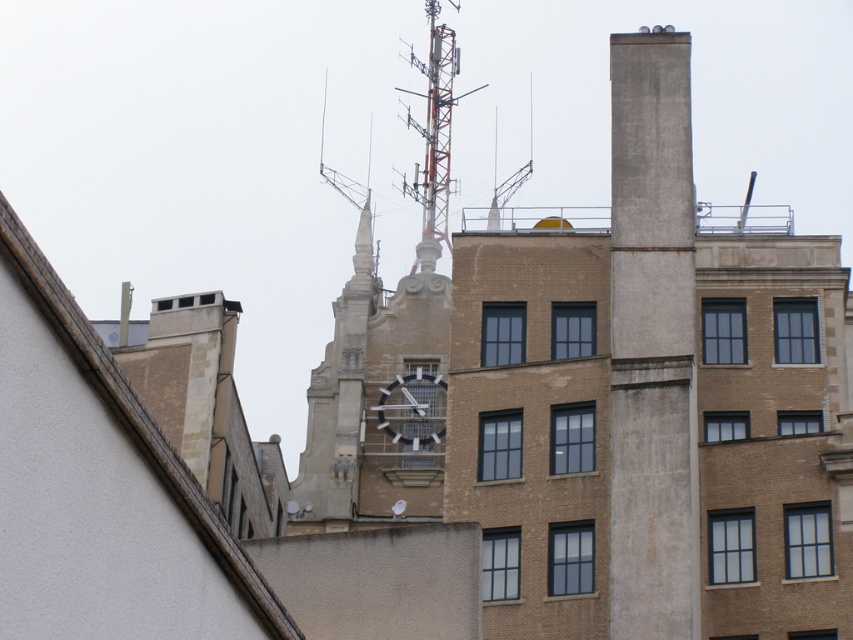
Question: Can you confirm if concrete chimney at right is smaller than orange metallic antenna at upper center?

Choices:
 (A) yes
 (B) no

Answer: (A)

Question: Among these objects, which one is farthest from the camera?

Choices:
 (A) metallic gray clock at center
 (B) orange metallic antenna at upper center
 (C) concrete chimney at right

Answer: (B)

Question: Is concrete chimney at right closer to camera compared to orange metallic antenna at upper center?

Choices:
 (A) yes
 (B) no

Answer: (A)

Question: Which of the following is the closest to the observer?

Choices:
 (A) (633, 92)
 (B) (440, 403)
 (C) (425, 209)

Answer: (A)

Question: Is concrete chimney at right bigger than metallic gray clock at center?

Choices:
 (A) no
 (B) yes

Answer: (B)

Question: Which object appears closest to the camera in this image?

Choices:
 (A) concrete chimney at right
 (B) orange metallic antenna at upper center

Answer: (A)